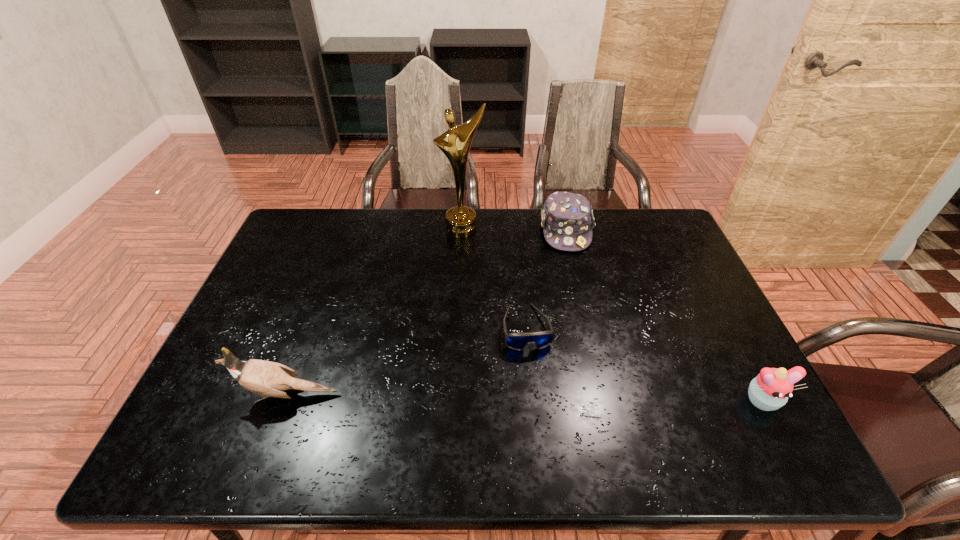
Locate an element on the screen. This screenshot has height=540, width=960. free space on the desktop that is between the second tallest object and the cupcake and is positioned on the front-facing side of the sunglasses is located at coordinates (541, 397).

This screenshot has width=960, height=540. Find the location of `vacant space on the desktop that is between the fourth shortest object and the rightmost object and is positioned on the front-facing side of the second object from left to right`. vacant space on the desktop that is between the fourth shortest object and the rightmost object and is positioned on the front-facing side of the second object from left to right is located at coordinates (519, 397).

Locate an element on the screen. Image resolution: width=960 pixels, height=540 pixels. vacant space on the desktop that is between the bird and the cupcake and is positioned on the front-facing side of the headwear is located at coordinates (589, 398).